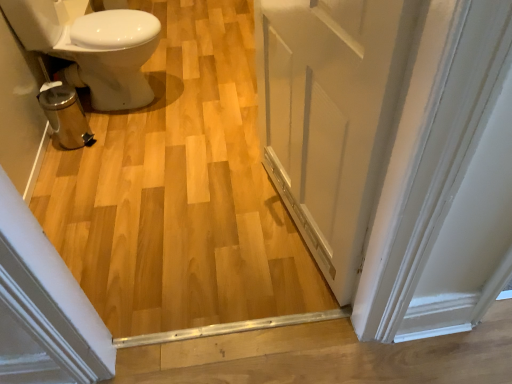
You are a GUI agent. You are given a task and a screenshot of the screen. Output one action in this format:
    pyautogui.click(x=<x>, y=<y>)
    Task: Click on the white painted wood door at center
    
    Given the screenshot: What is the action you would take?
    pyautogui.click(x=332, y=115)

The height and width of the screenshot is (384, 512). What do you see at coordinates (332, 115) in the screenshot? I see `white painted wood door at center` at bounding box center [332, 115].

Identify the location of white glossy bidet at left. (110, 56).

The height and width of the screenshot is (384, 512). What do you see at coordinates (110, 56) in the screenshot? I see `white glossy bidet at left` at bounding box center [110, 56].

You are a GUI agent. You are given a task and a screenshot of the screen. Output one action in this format:
    pyautogui.click(x=<x>, y=<y>)
    Task: Click on the white painted wood door at center
    
    Given the screenshot: What is the action you would take?
    pyautogui.click(x=332, y=115)

Visually, is white painted wood door at center positioned to the left or to the right of white glossy bidet at left?

In the image, white painted wood door at center appears on the right side of white glossy bidet at left.

Considering the positions of objects white painted wood door at center and white glossy bidet at left in the image provided, who is in front, white painted wood door at center or white glossy bidet at left?

white painted wood door at center is closer to the camera.

Which point is more distant from viewer, (376, 160) or (137, 44)?

The point (137, 44) is behind.

Consider the image. From the image's perspective, is white painted wood door at center positioned above or below white glossy bidet at left?

Clearly, from the image's perspective, white painted wood door at center is below white glossy bidet at left.

From a real-world perspective, is white painted wood door at center on white glossy bidet at left?

Yes, from a real-world perspective, white painted wood door at center is above white glossy bidet at left.

Is white painted wood door at center thinner than white glossy bidet at left?

Correct, the width of white painted wood door at center is less than that of white glossy bidet at left.

From their relative heights in the image, would you say white painted wood door at center is taller or shorter than white glossy bidet at left?

white painted wood door at center is taller than white glossy bidet at left.

Looking at this image, considering the relative sizes of white painted wood door at center and white glossy bidet at left in the image provided, is white painted wood door at center bigger than white glossy bidet at left?

Actually, white painted wood door at center might be smaller than white glossy bidet at left.

From the picture: Would you say white painted wood door at center is inside or outside white glossy bidet at left?

white painted wood door at center is not inside white glossy bidet at left, it's outside.

Is there a large distance between white painted wood door at center and white glossy bidet at left?

Yes, white painted wood door at center and white glossy bidet at left are located far from each other.

Is white painted wood door at center facing towards white glossy bidet at left?

No, white painted wood door at center is not turned towards white glossy bidet at left.

Can you tell me how much white painted wood door at center and white glossy bidet at left differ in facing direction?

167 degrees.

Locate an element on the screen. bidet on the left side of white painted wood door at center is located at coordinates (110, 56).

Which is more to the left, white glossy bidet at left or white painted wood door at center?

From the viewer's perspective, white glossy bidet at left appears more on the left side.

Is the depth of white glossy bidet at left less than that of white painted wood door at center?

No, the depth of white glossy bidet at left is greater than that of white painted wood door at center.

Between point (75, 49) and point (347, 232), which one is positioned behind?

Point (75, 49)

From the image's perspective, which object appears higher, white glossy bidet at left or white painted wood door at center?

white glossy bidet at left appears higher in the image.

From a real-world perspective, is white glossy bidet at left physically located above or below white painted wood door at center?

white glossy bidet at left is situated lower than white painted wood door at center in the real world.

Can you confirm if white glossy bidet at left is thinner than white painted wood door at center?

In fact, white glossy bidet at left might be wider than white painted wood door at center.

Based on the photo, between white glossy bidet at left and white painted wood door at center, which one has more height?

white painted wood door at center is taller.

Considering the sizes of white glossy bidet at left and white painted wood door at center in the image, is white glossy bidet at left bigger or smaller than white painted wood door at center?

Considering their sizes, white glossy bidet at left takes up more space than white painted wood door at center.

In the scene shown: Does white glossy bidet at left contain white painted wood door at center?

That's incorrect, white painted wood door at center is not inside white glossy bidet at left.

Is white glossy bidet at left far away from white painted wood door at center?

Indeed, white glossy bidet at left is not near white painted wood door at center.

Is white painted wood door at center at the back of white glossy bidet at left?

No, white glossy bidet at left is not facing away from white painted wood door at center.

How different are the orientations of white glossy bidet at left and white painted wood door at center in degrees?

167 degrees separate the facing orientations of white glossy bidet at left and white painted wood door at center.

Locate an element on the screen. door on the right of white glossy bidet at left is located at coordinates (332, 115).

This screenshot has height=384, width=512. What are the coordinates of `door above the white glossy bidet at left (from a real-world perspective)` in the screenshot? It's located at (332, 115).

This screenshot has height=384, width=512. Find the location of `bidet on the left of white painted wood door at center`. bidet on the left of white painted wood door at center is located at coordinates (110, 56).